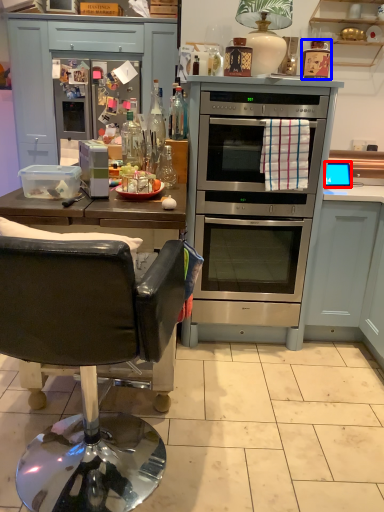
Question: Which of the following is the closest to the observer, appliance (highlighted by a red box) or appliance (highlighted by a blue box)?

Choices:
 (A) appliance
 (B) appliance

Answer: (B)